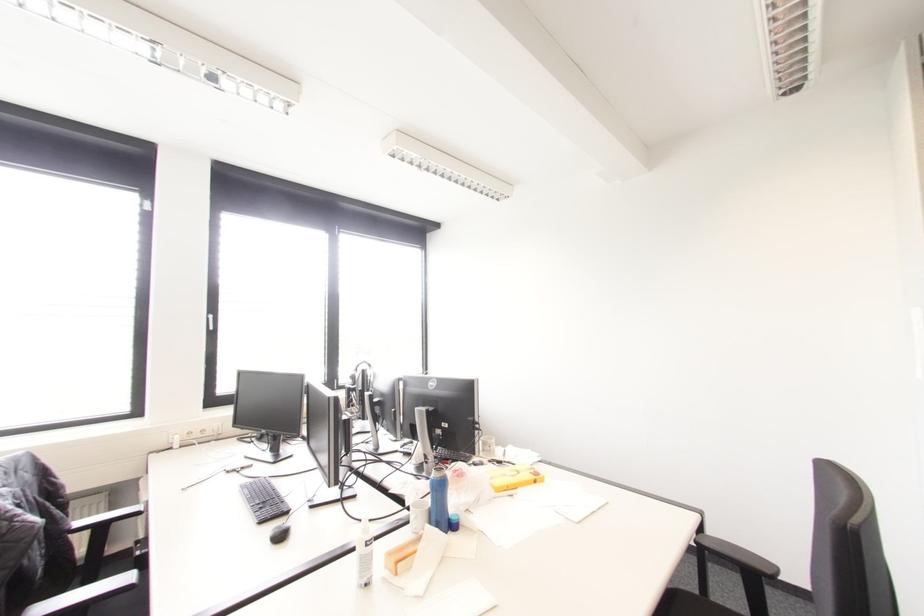
Locate an element on the screen. This screenshot has width=924, height=616. spray bottle pump is located at coordinates (363, 554).